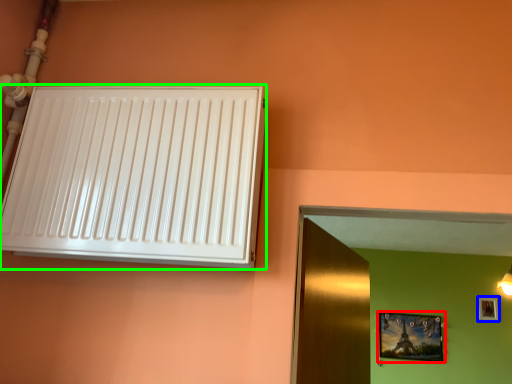
Question: Estimate the real-world distances between objects in this image. Which object is farther from picture frame (highlighted by a red box), picture frame (highlighted by a blue box) or air conditioning (highlighted by a green box)?

Choices:
 (A) picture frame
 (B) air conditioning

Answer: (B)